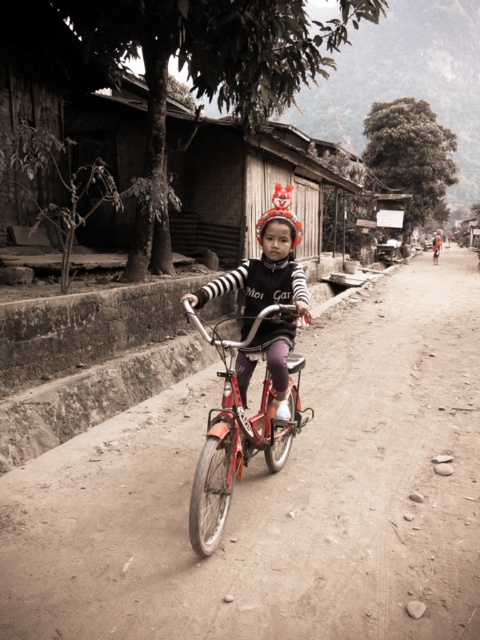
You are a delivery drone flying above the dirt track at center and metallic red bicycle at center. To safely navigate between them, which direction should you adjust your path towards?

The dirt track at center is positioned on the right side of metallic red bicycle at center, so you should adjust your path to the left to navigate safely between them.

You are a delivery drone flying above the dirt road. You need to land on the dirt track at center to drop off a package. The metallic red bicycle at center is currently in your path. Is there enough space between them for you to safely land?

The distance between dirt track at center and metallic red bicycle at center is 5.96 feet. Since drones typically require a minimum of 5 feet of clearance for safe landing, there is sufficient space to land safely between them.